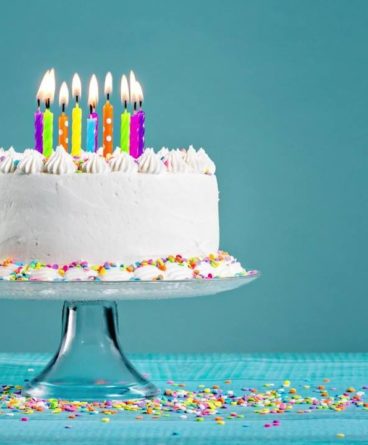
Find the location of `candle wicks`. candle wicks is located at coordinates (38, 104), (47, 105), (63, 108), (76, 100), (91, 110), (94, 106), (108, 96), (126, 106), (135, 105), (140, 104).